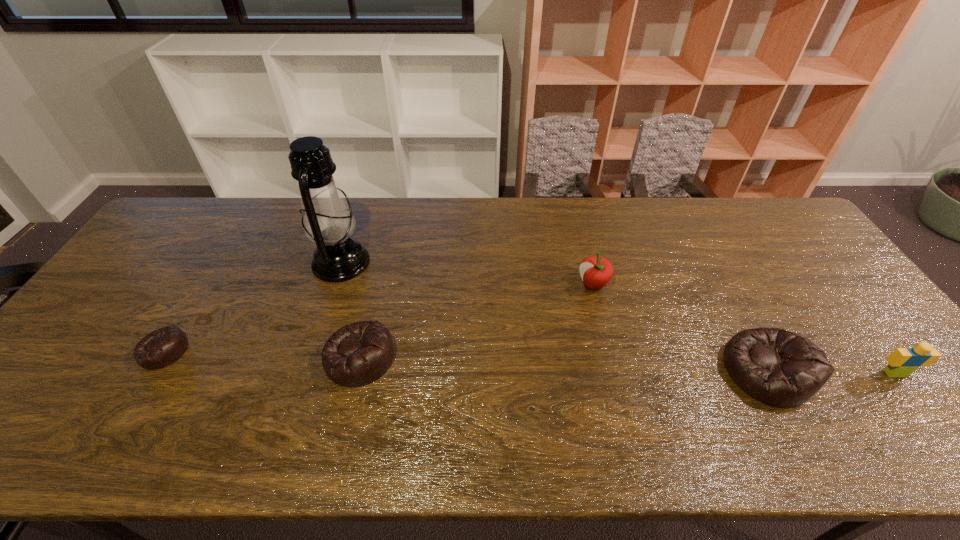
Locate an element on the screen. The image size is (960, 540). vacant position for inserting another beanbag evenly is located at coordinates (560, 364).